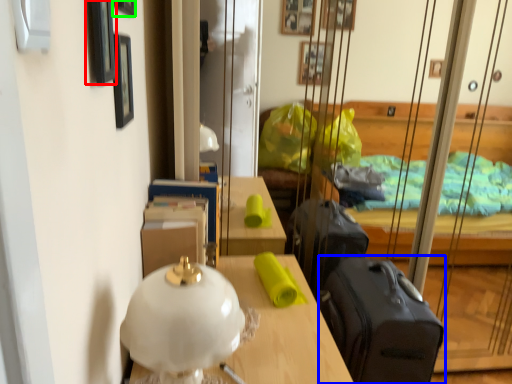
Question: Considering the real-world distances, which object is closest to picture frame (highlighted by a red box)? suitcase (highlighted by a blue box) or picture frame (highlighted by a green box).

Choices:
 (A) suitcase
 (B) picture frame

Answer: (B)